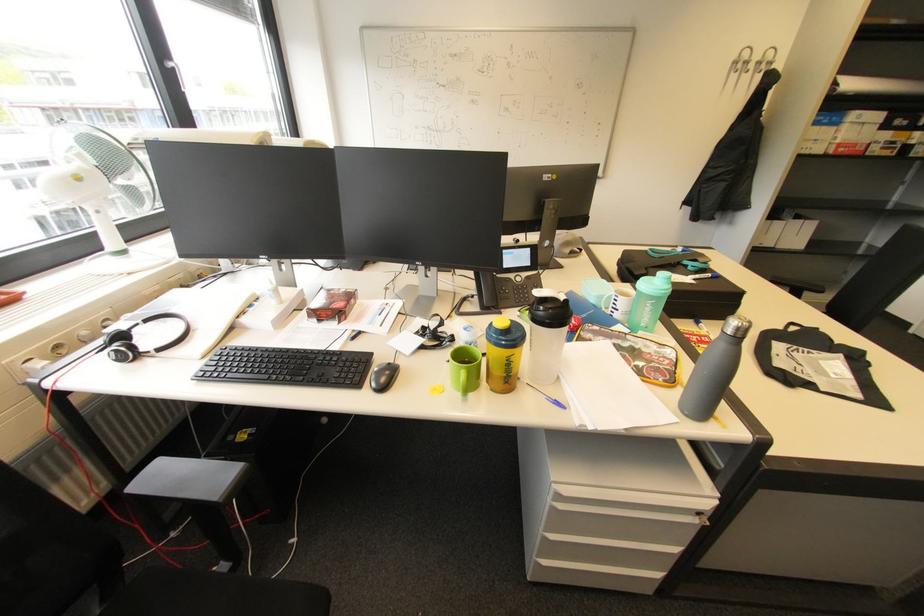
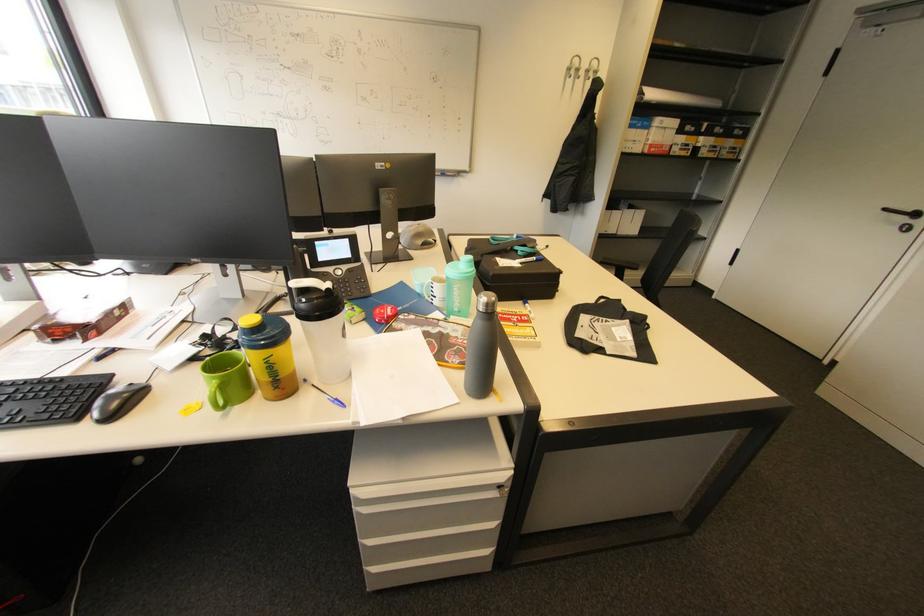
Question: The camera is either moving clockwise (left) or counter-clockwise (right) around the object. The first image is from the beginning of the video and the second image is from the end. Is the camera moving left or right when shooting the video?

Choices:
 (A) Left
 (B) Right

Answer: (A)